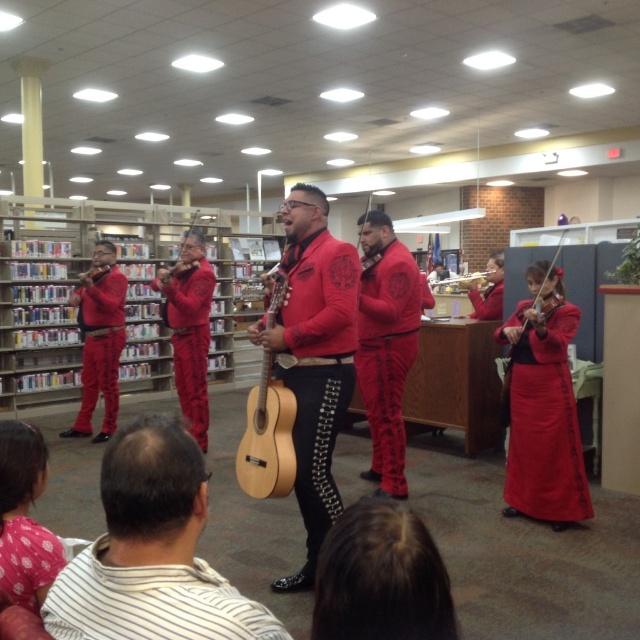
Is matte red mariachi outfit at center smaller than natural wood guitar at center?

Actually, matte red mariachi outfit at center might be larger than natural wood guitar at center.

Locate an element on the screen. The width and height of the screenshot is (640, 640). matte red mariachi outfit at center is located at coordinates (189, 328).

Locate an element on the screen. The width and height of the screenshot is (640, 640). matte red mariachi outfit at center is located at coordinates (189, 328).

Between matte red guitar at center and matte red pantsuit at left, which one appears on the left side from the viewer's perspective?

From the viewer's perspective, matte red pantsuit at left appears more on the left side.

You are a GUI agent. You are given a task and a screenshot of the screen. Output one action in this format:
    pyautogui.click(x=<x>, y=<y>)
    Task: Click on the matte red guitar at center
    The height and width of the screenshot is (640, 640).
    Given the screenshot: What is the action you would take?
    pyautogui.click(x=314, y=358)

Is matte red skirt at lower right above matte red pantsuit at left?

No.

Who is positioned more to the right, matte red skirt at lower right or matte red pantsuit at left?

matte red skirt at lower right is more to the right.

Does point (572, 408) come farther from viewer compared to point (120, 326)?

No, it is not.

Locate an element on the screen. The width and height of the screenshot is (640, 640). matte red skirt at lower right is located at coordinates (541, 406).